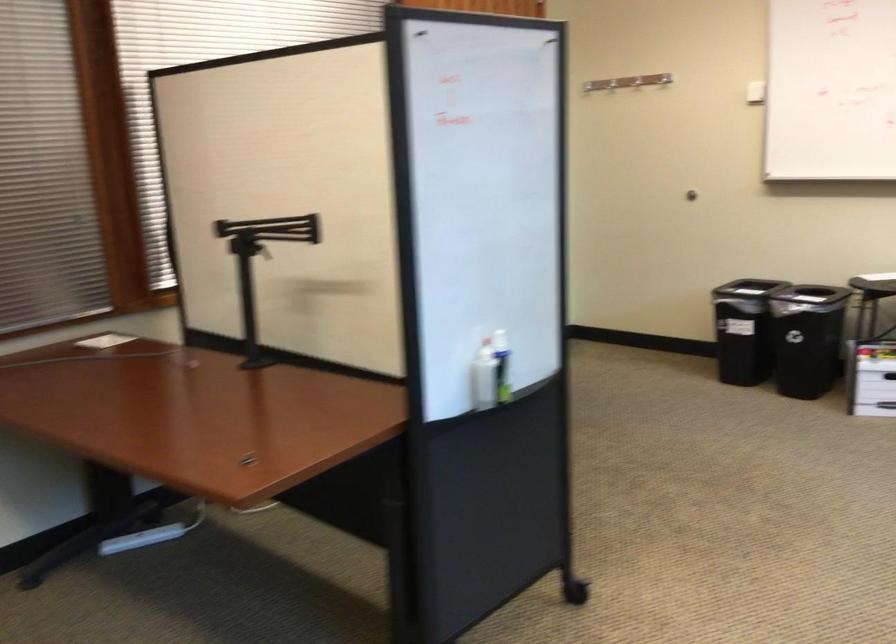
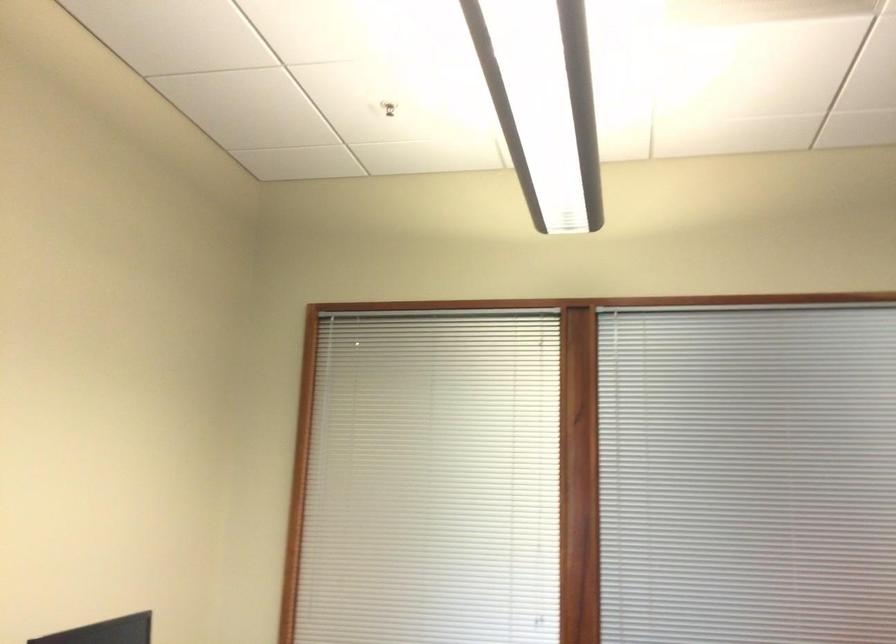
Question: Based on the continuous images, in which direction is the camera rotating? Reply with the corresponding letter.

Choices:
 (A) Left
 (B) Right
 (C) Up
 (D) Down

Answer: (A)